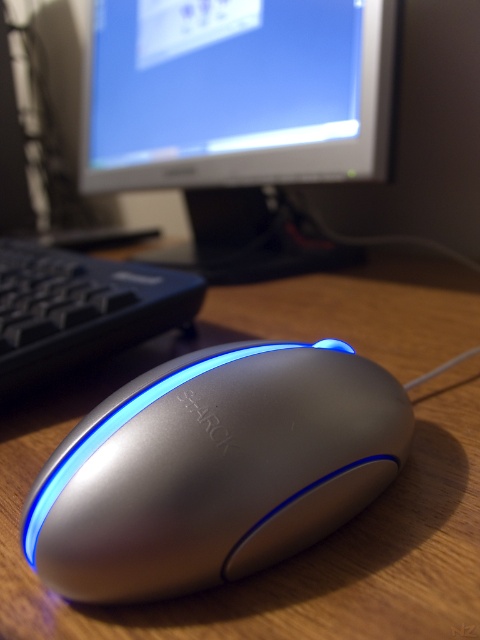
Measure the distance from satin silver mouse at center to black plastic keyboard at left.

satin silver mouse at center is 11.60 inches from black plastic keyboard at left.

Between point (118, 458) and point (81, 307), which one is positioned in front?

Point (118, 458)

Who is more distant from viewer, (206, 451) or (33, 244)?

Point (33, 244)

Where is `satin silver mouse at center`? The width and height of the screenshot is (480, 640). satin silver mouse at center is located at coordinates (214, 468).

Does matte plastic monitor at upper center have a smaller size compared to black plastic keyboard at left?

No, matte plastic monitor at upper center is not smaller than black plastic keyboard at left.

Describe the element at coordinates (236, 92) in the screenshot. The width and height of the screenshot is (480, 640). I see `matte plastic monitor at upper center` at that location.

Image resolution: width=480 pixels, height=640 pixels. What do you see at coordinates (236, 92) in the screenshot?
I see `matte plastic monitor at upper center` at bounding box center [236, 92].

I want to click on matte plastic monitor at upper center, so click(236, 92).

Can you confirm if satin silver mouse at center is shorter than matte plastic monitor at upper center?

Yes, satin silver mouse at center is shorter than matte plastic monitor at upper center.

Does satin silver mouse at center come in front of matte plastic monitor at upper center?

Yes, it is.

Identify the location of satin silver mouse at center. (214, 468).